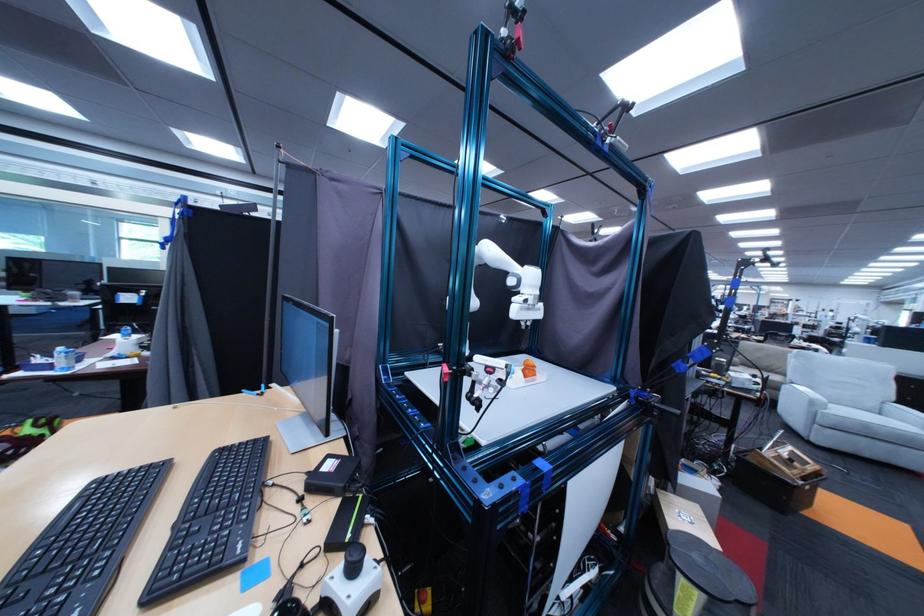
Where would you sit the sofa sitting surface? Please return your answer as a coordinate pair (x, y).

(882, 424)